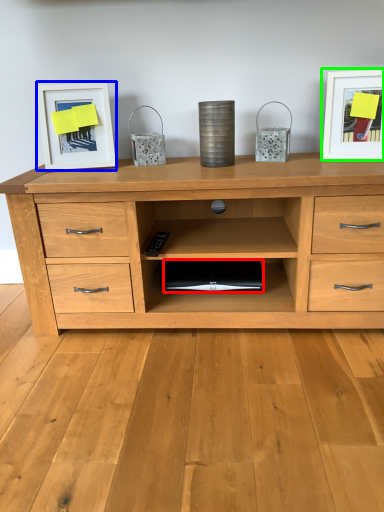
Question: Which object is positioned farthest from computer (highlighted by a red box)? Select from picture frame (highlighted by a blue box) and picture frame (highlighted by a green box).

Choices:
 (A) picture frame
 (B) picture frame

Answer: (B)